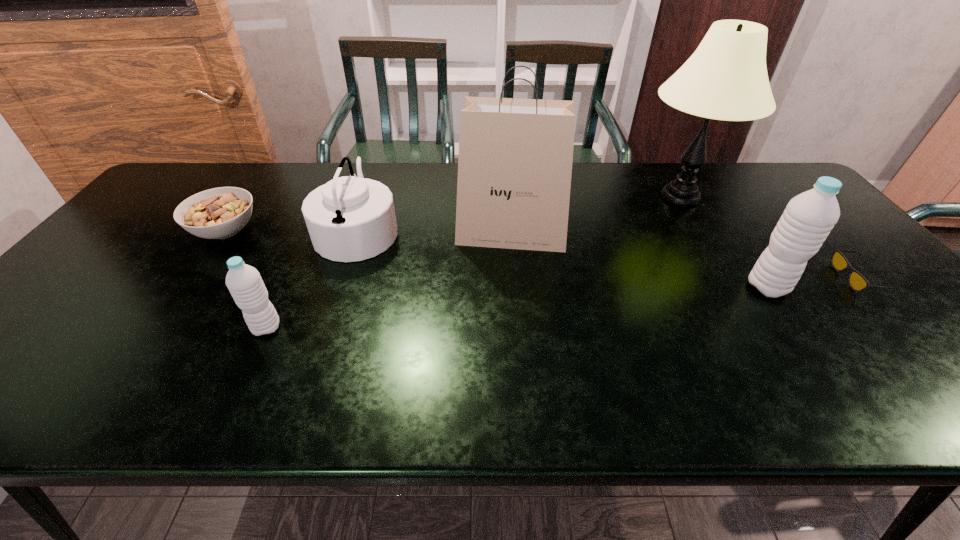
At what (x,y) coordinates should I click in order to perform the action: click on free space that satisfies the following two spatial constraints: 1. on the back side of the shopping bag; 2. on the spout of the kettle. Please return your answer as a coordinate pair (x, y). Image resolution: width=960 pixels, height=540 pixels. Looking at the image, I should click on (511, 230).

You are a GUI agent. You are given a task and a screenshot of the screen. Output one action in this format:
    pyautogui.click(x=<x>, y=<y>)
    Task: Click on the vacant position in the image that satisfies the following two spatial constraints: 1. on the spout of the kettle; 2. on the left side of the farther water bottle
    
    Given the screenshot: What is the action you would take?
    pyautogui.click(x=339, y=287)